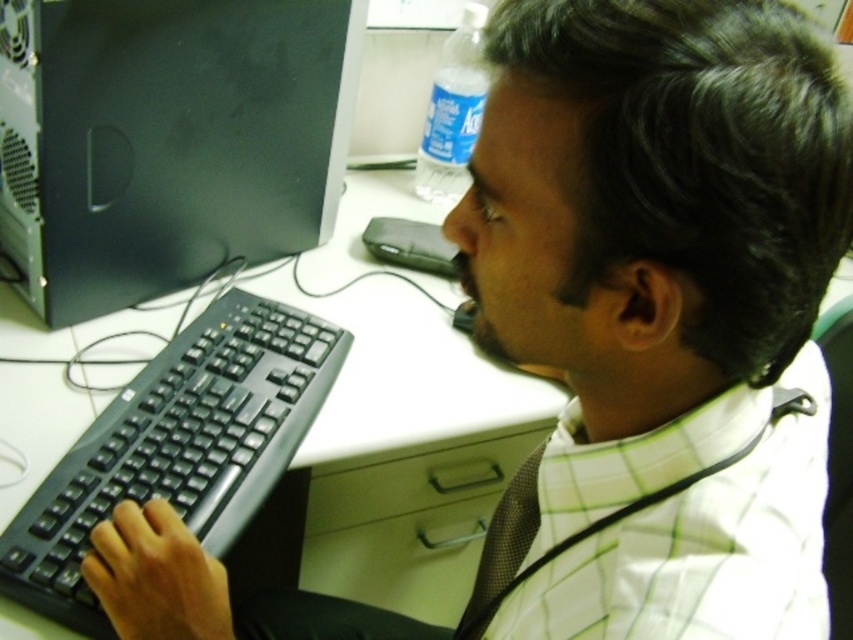
Is black plastic desktop computer at left positioned behind black plastic keyboard at left?

That is True.

Which is in front, point (172, 106) or point (248, 477)?

Positioned in front is point (248, 477).

Find the location of a particular element. black plastic desktop computer at left is located at coordinates pos(166,140).

Between black plastic desktop computer at left and white plastic computer desk at center, which one appears on the left side from the viewer's perspective?

Positioned to the left is black plastic desktop computer at left.

Between black plastic desktop computer at left and white plastic computer desk at center, which one appears on the right side from the viewer's perspective?

white plastic computer desk at center

Is point (90, 54) positioned in front of point (389, 305)?

Yes.

Where is `black plastic desktop computer at left`? black plastic desktop computer at left is located at coordinates (166, 140).

Between white plastic computer desk at center and black plastic keyboard at left, which one has more height?

Standing taller between the two is white plastic computer desk at center.

Is point (395, 428) closer to viewer compared to point (288, 452)?

No, (395, 428) is behind (288, 452).

Image resolution: width=853 pixels, height=640 pixels. In order to click on white plastic computer desk at center in this screenshot , I will do pos(393,340).